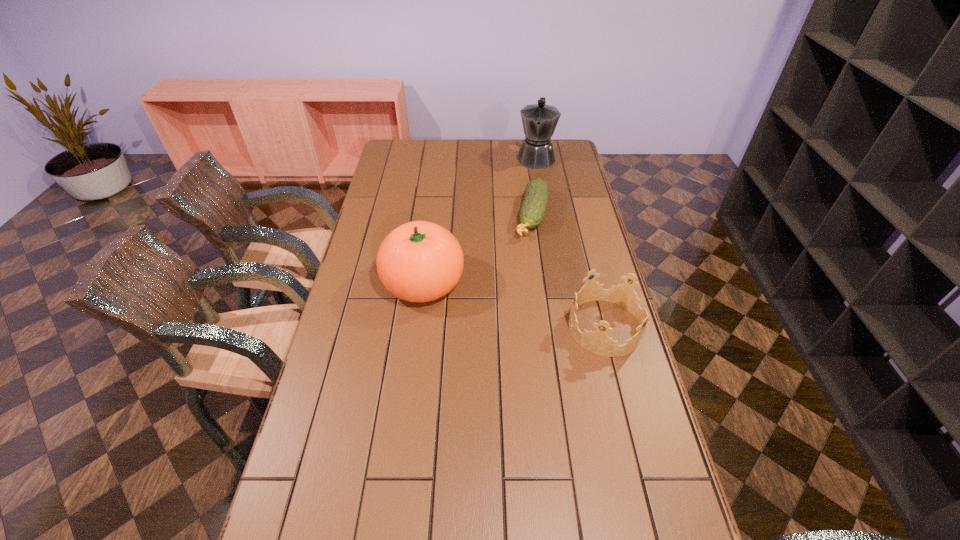
Image resolution: width=960 pixels, height=540 pixels. Find the location of `object that is at the far right corner`. object that is at the far right corner is located at coordinates (539, 121).

The image size is (960, 540). In the image, there is a desktop. Identify the location of vacant space at the far edge. (484, 151).

In the image, there is a desktop. In order to click on vacant space at the near edge in this screenshot , I will do `click(499, 522)`.

Locate an element on the screen. This screenshot has height=540, width=960. vacant area at the left edge of the desktop is located at coordinates (366, 378).

The width and height of the screenshot is (960, 540). Identify the location of vacant space at the right edge of the desktop. (635, 353).

Where is `free space between the pumpkin and the shortest object`? This screenshot has width=960, height=540. free space between the pumpkin and the shortest object is located at coordinates (477, 249).

This screenshot has height=540, width=960. In order to click on free space that is in between the farthest object and the pumpkin in this screenshot , I will do `click(479, 220)`.

You are a GUI agent. You are given a task and a screenshot of the screen. Output one action in this format:
    pyautogui.click(x=<x>, y=<y>)
    Task: Click on the vacant area that lies between the third shortest object and the third tallest object
    This screenshot has height=540, width=960.
    Given the screenshot: What is the action you would take?
    pyautogui.click(x=515, y=305)

Locate an element on the screen. The width and height of the screenshot is (960, 540). unoccupied position between the farthest object and the leftmost object is located at coordinates (479, 220).

Where is `free spot between the second tallest object and the tiara`? The width and height of the screenshot is (960, 540). free spot between the second tallest object and the tiara is located at coordinates (515, 305).